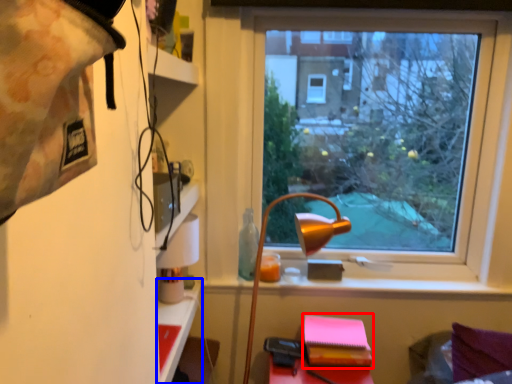
Question: Among these objects, which one is farthest to the camera, notebook (highlighted by a red box) or table (highlighted by a blue box)?

Choices:
 (A) notebook
 (B) table

Answer: (A)